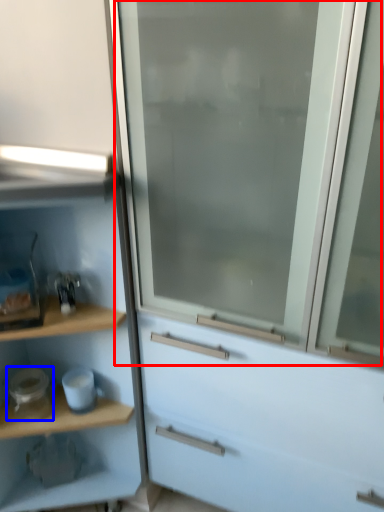
Question: Which point is further to the camera, screen door (highlighted by a red box) or appliance (highlighted by a blue box)?

Choices:
 (A) screen door
 (B) appliance

Answer: (B)